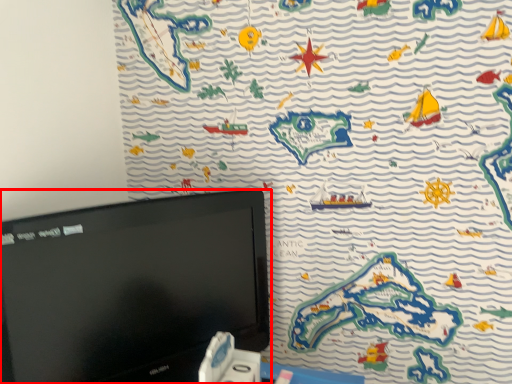
Question: Where is computer monitor (annotated by the red box) located in relation to game controller in the image?

Choices:
 (A) left
 (B) right

Answer: (A)